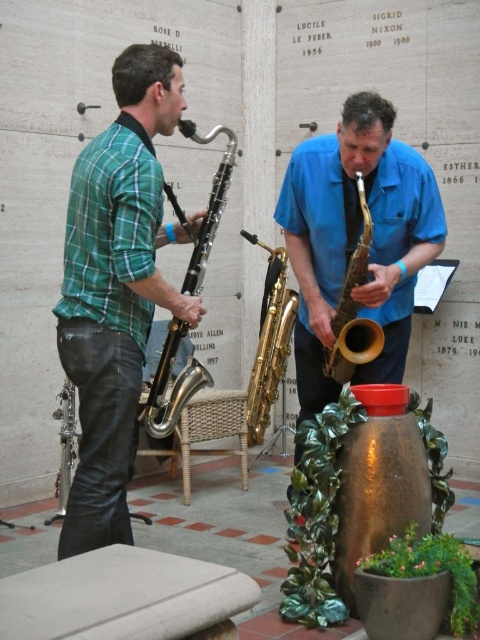
You are a stagehand setting up a music performance. You need to place a stand between the blue glossy saxophone at center and the gold brass saxophone at center. Based on their widths, which saxophone requires a wider stand?

The blue glossy saxophone at center might be wider than the gold brass saxophone at center, so the blue glossy saxophone at center likely needs a wider stand.